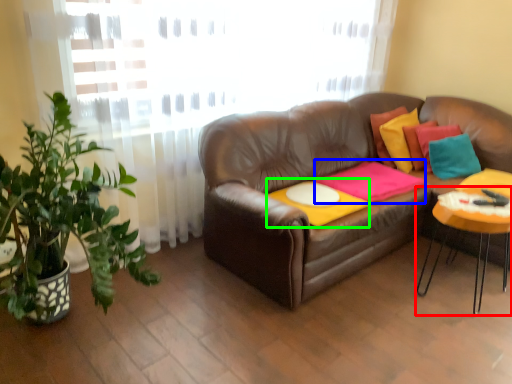
Question: Which object is the farthest from table (highlighted by a red box)? Choose among these: blanket (highlighted by a blue box) or round table (highlighted by a green box).

Choices:
 (A) blanket
 (B) round table

Answer: (B)